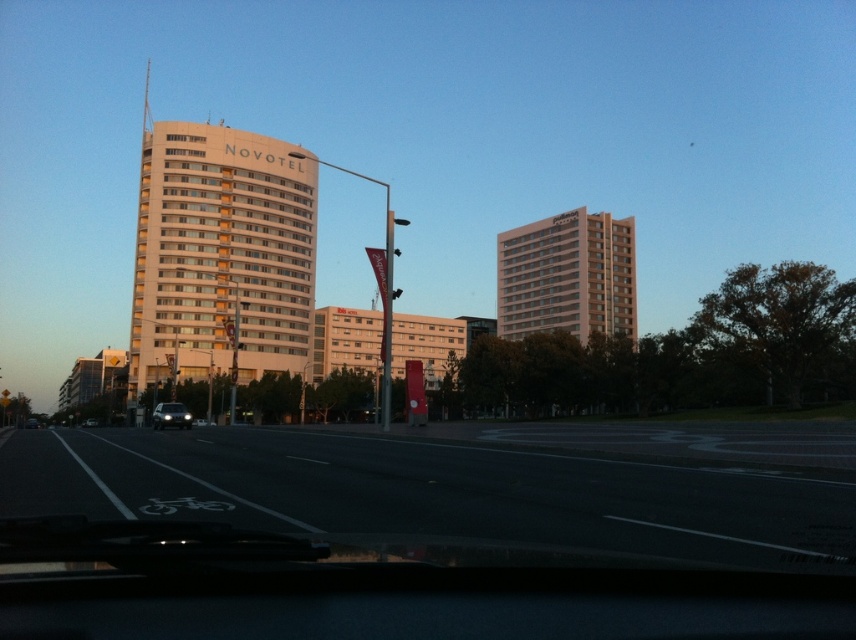
This screenshot has height=640, width=856. Describe the element at coordinates (221, 256) in the screenshot. I see `white smooth building at center` at that location.

Measure the distance between white smooth building at center and camera.

white smooth building at center and camera are 62.02 meters apart.

Which is behind, point (186, 176) or point (556, 244)?

The point (556, 244) is more distant.

Locate an element on the screen. white smooth building at center is located at coordinates (221, 256).

Does shiny silver car at center have a lesser height compared to silver metallic sedan at center?

No, shiny silver car at center is not shorter than silver metallic sedan at center.

Does shiny silver car at center appear over silver metallic sedan at center?

Indeed, shiny silver car at center is positioned over silver metallic sedan at center.

Is point (177, 419) positioned behind point (87, 420)?

No, it is not.

Locate an element on the screen. This screenshot has width=856, height=640. shiny silver car at center is located at coordinates (171, 416).

Does white smooth building at center appear on the left side of silver metallic sedan at center?

Yes, white smooth building at center is to the left of silver metallic sedan at center.

Which is below, white smooth building at center or silver metallic sedan at center?

silver metallic sedan at center

Which is behind, point (302, 228) or point (97, 424)?

Positioned behind is point (302, 228).

Where is `white smooth building at center`? white smooth building at center is located at coordinates (221, 256).